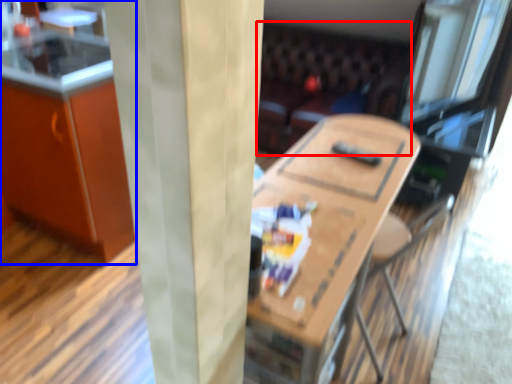
Question: Which object appears farthest to the camera in this image, couch (highlighted by a red box) or cabinetry (highlighted by a blue box)?

Choices:
 (A) couch
 (B) cabinetry

Answer: (A)